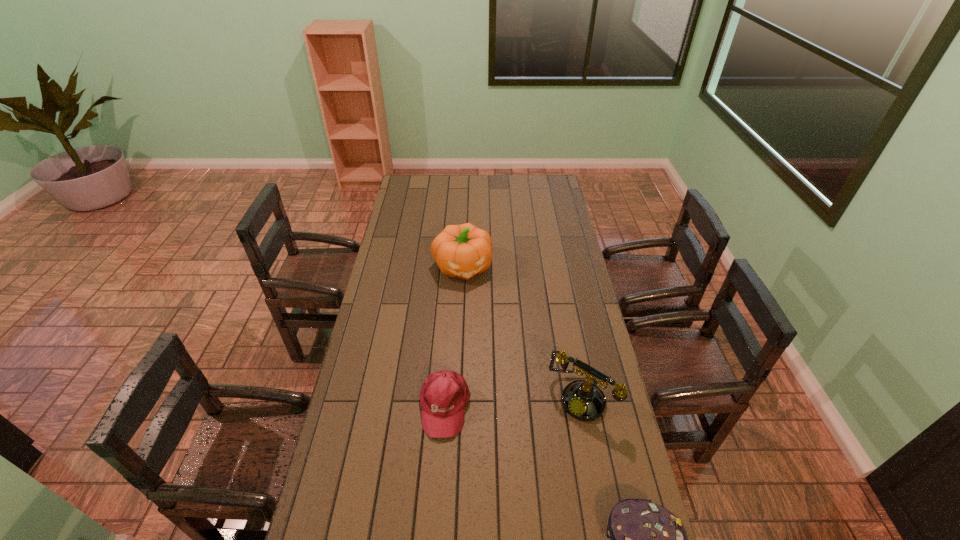
Image resolution: width=960 pixels, height=540 pixels. In order to click on baseball cap in this screenshot , I will do `click(444, 395)`.

Where is `pumpkin`? The height and width of the screenshot is (540, 960). pumpkin is located at coordinates (463, 251).

Locate an element on the screen. telephone is located at coordinates (584, 401).

Find the location of `free space located at the front of the baseball cap with the brim`. free space located at the front of the baseball cap with the brim is located at coordinates (438, 519).

What are the coordinates of `vacant area situated 0.190m on the carved face of the pumpkin` in the screenshot? It's located at (475, 318).

Locate an element on the screen. The height and width of the screenshot is (540, 960). vacant area situated 0.200m on the carved face of the pumpkin is located at coordinates (476, 320).

Locate an element on the screen. The height and width of the screenshot is (540, 960). free space located on the carved face of the pumpkin is located at coordinates (485, 355).

This screenshot has width=960, height=540. I want to click on vacant area located 0.080m on the dial of the telephone, so click(552, 438).

You are a GUI agent. You are given a task and a screenshot of the screen. Output one action in this format:
    pyautogui.click(x=<x>, y=<y>)
    Task: Click on the vacant space located 0.370m on the dial of the telephone
    
    Given the screenshot: What is the action you would take?
    pyautogui.click(x=498, y=516)

The width and height of the screenshot is (960, 540). I want to click on vacant space located 0.370m on the dial of the telephone, so click(x=498, y=516).